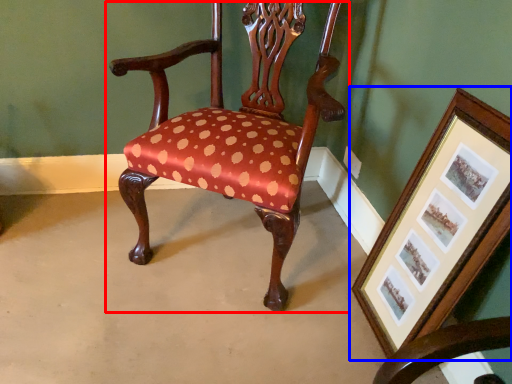
Question: Which object is further to the camera taking this photo, chair (highlighted by a red box) or picture frame (highlighted by a blue box)?

Choices:
 (A) chair
 (B) picture frame

Answer: (A)